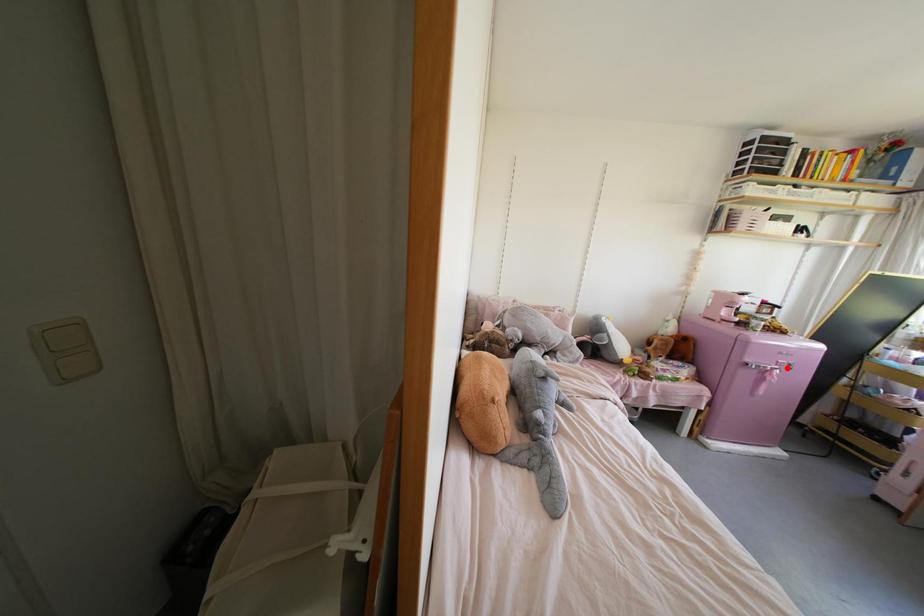
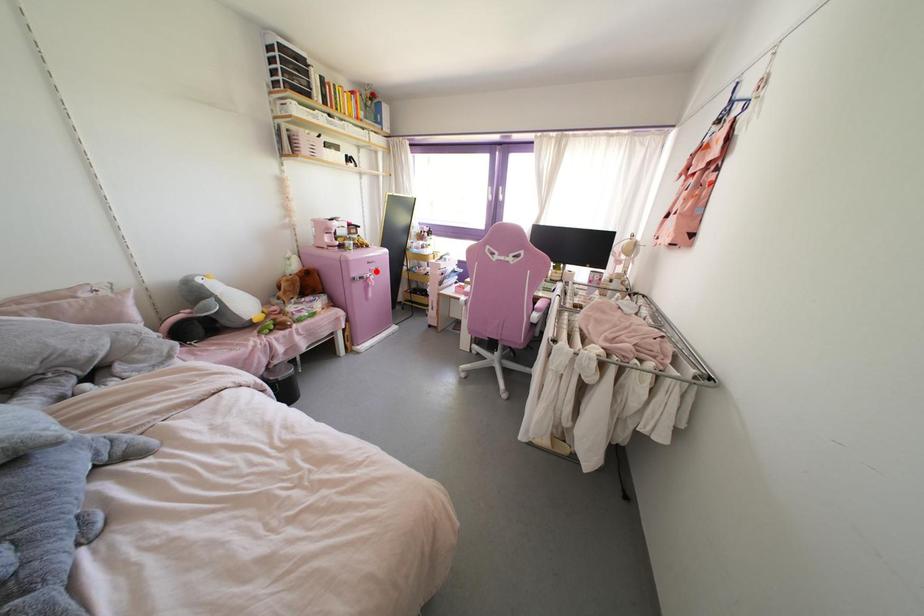
I am providing you with two images of the same scene from different viewpoints. A red point is marked on the first image and another point is marked on the second image. Are the points marked in image1 and image2 representing the same 3D position?

Yes